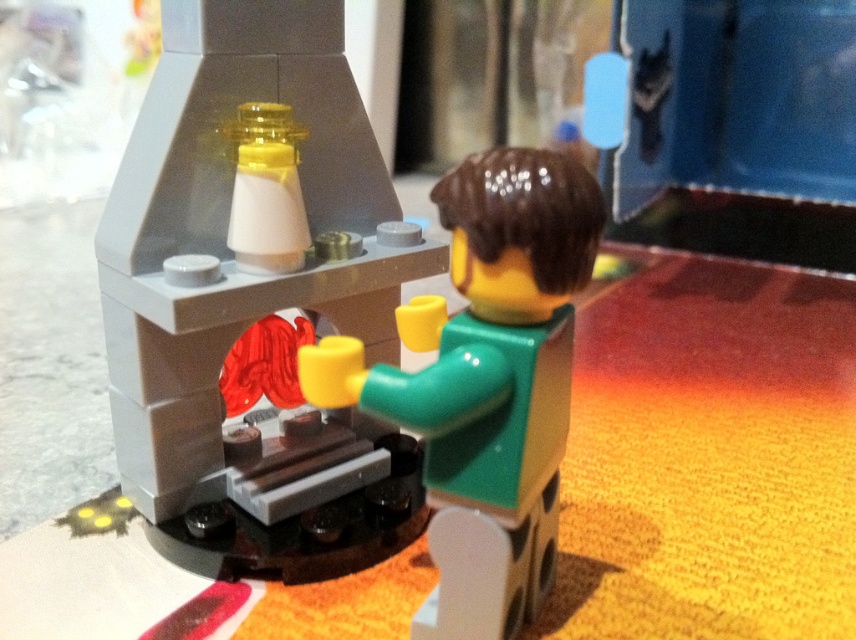
You are trying to place a new LEGO brick that is the same size as the green matte figure at center onto the smooth gray fireplace at center. Will it fit without overlapping the edges?

The smooth gray fireplace at center is larger in size than the green matte figure at center, so the new LEGO brick matching the figure size will fit without overlapping the edges.

You are standing in front of the LEGO set and want to locate the smooth gray fireplace at center. Which coordinates should you look at to find it?

You should look at point coordinates at point (254, 298) to find the smooth gray fireplace at center.

You are a LEGO enthusiast trying to assemble a fireplace scene. You have the smooth gray fireplace at center and the green matte figure at center. According to the instructions, which object should be placed first to ensure proper alignment?

The smooth gray fireplace at center should be placed first because it is positioned over the green matte figure at center, meaning the figure needs to be placed beneath it for correct alignment.